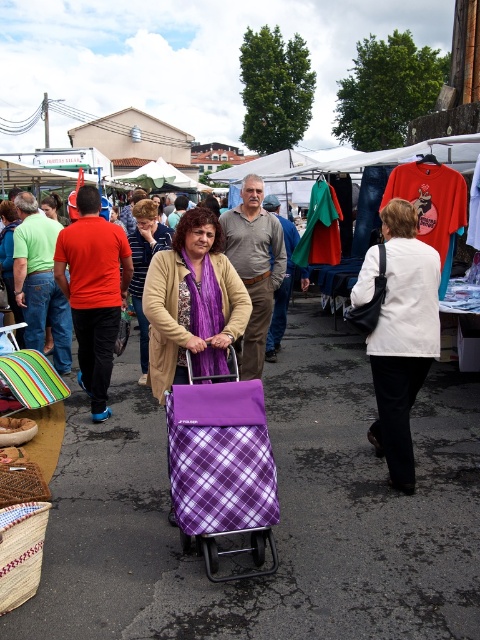
Question: Can you confirm if white matte jacket at center is bigger than purple plaid bag at center?

Choices:
 (A) no
 (B) yes

Answer: (A)

Question: Does white matte jacket at center have a smaller size compared to purple plaid shopping cart at center?

Choices:
 (A) yes
 (B) no

Answer: (A)

Question: Observing the image, what is the correct spatial positioning of purple plaid bag at center in reference to purple plaid shopping cart at center?

Choices:
 (A) above
 (B) below

Answer: (B)

Question: Among these objects, which one is farthest from the camera?

Choices:
 (A) purple plaid cart at center
 (B) white matte jacket at center

Answer: (A)

Question: Estimate the real-world distances between objects in this image. Which object is farther from the purple plaid fabric cart at center?

Choices:
 (A) purple plaid bag at center
 (B) purple plaid shopping cart at center

Answer: (B)

Question: Considering the real-world distances, which object is closest to the white matte jacket at center?

Choices:
 (A) purple plaid fabric cart at center
 (B) purple plaid shopping cart at center

Answer: (A)